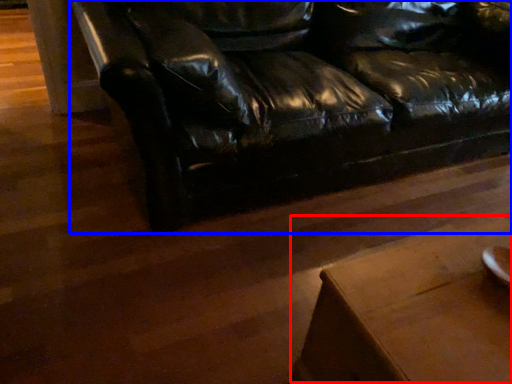
Question: Among these objects, which one is farthest to the camera, table (highlighted by a red box) or studio couch (highlighted by a blue box)?

Choices:
 (A) table
 (B) studio couch

Answer: (B)